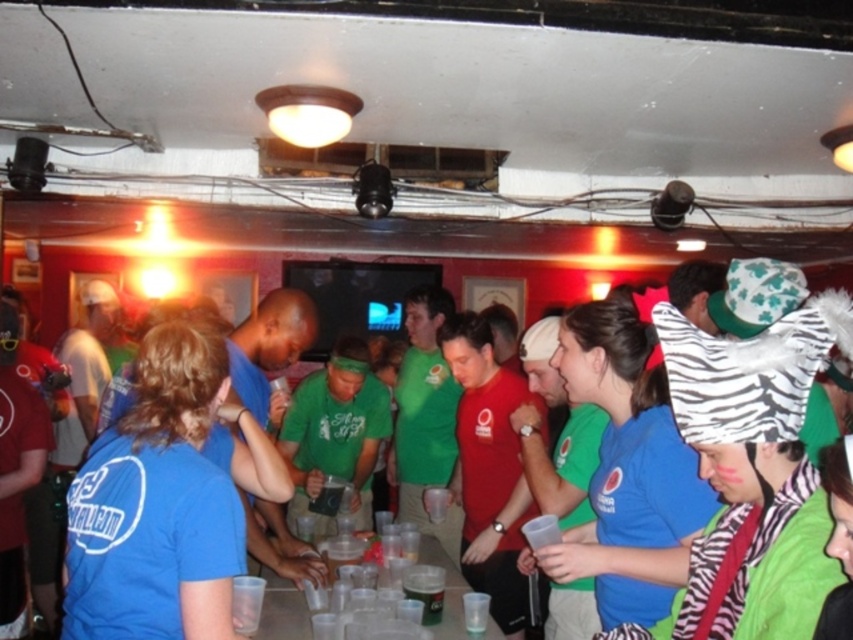
Who is shorter, blue fabric shirt at center or black plastic cup at center?

black plastic cup at center is shorter.

Image resolution: width=853 pixels, height=640 pixels. What are the coordinates of `blue fabric shirt at center` in the screenshot? It's located at (817, 420).

Between point (297, 628) and point (421, 568), which one is positioned behind?

Positioned behind is point (421, 568).

Identify the location of blue fabric shirt at center. Image resolution: width=853 pixels, height=640 pixels. (817, 420).